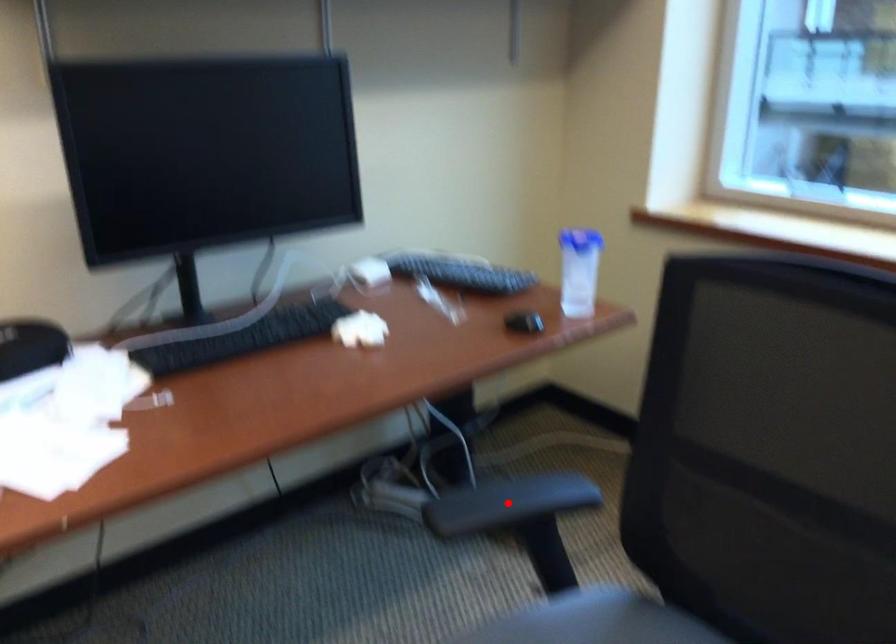
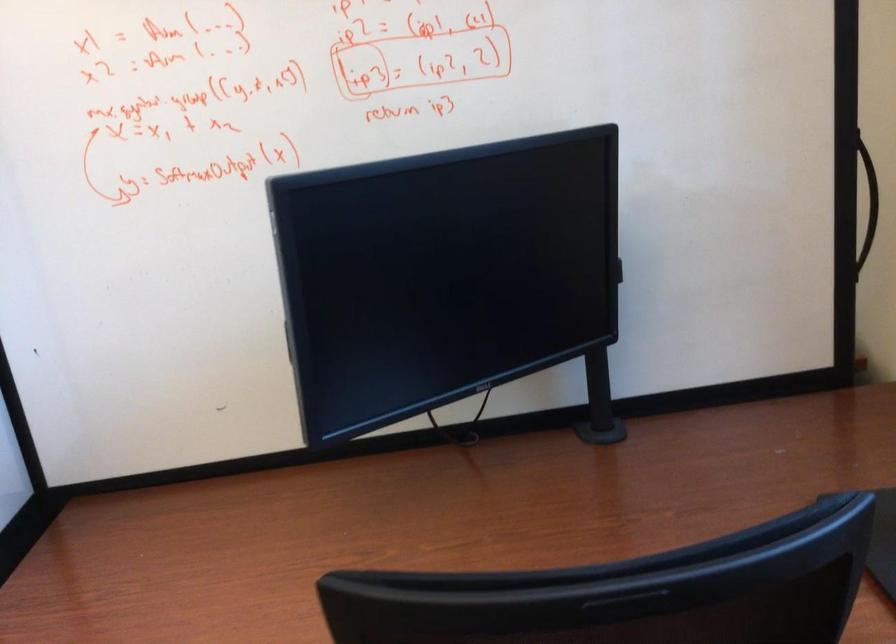
Question: I am providing you with two images of the same scene from different viewpoints. A red point is marked on the first image. At the location where the point appears in image 1, is it still visible in image 2?

Choices:
 (A) Yes
 (B) No

Answer: (B)